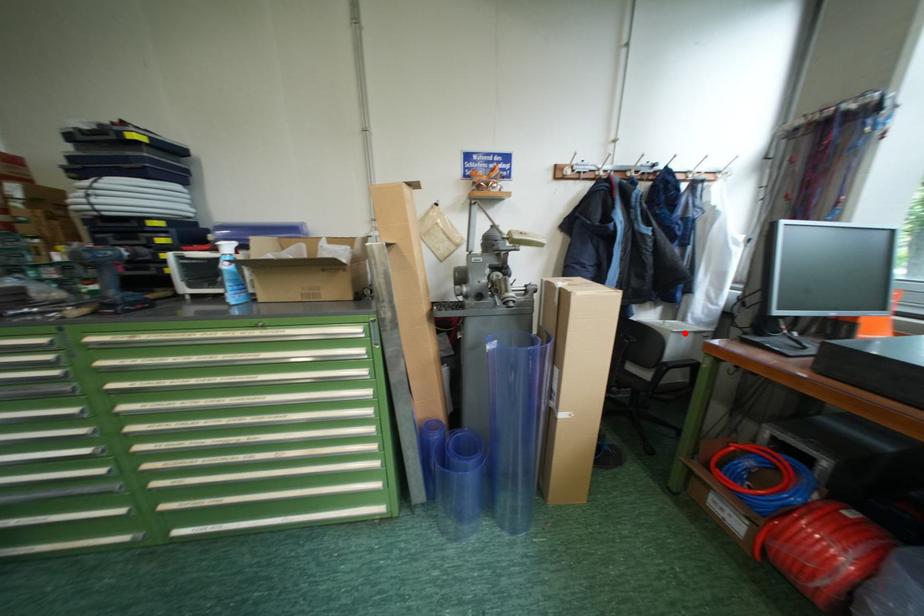
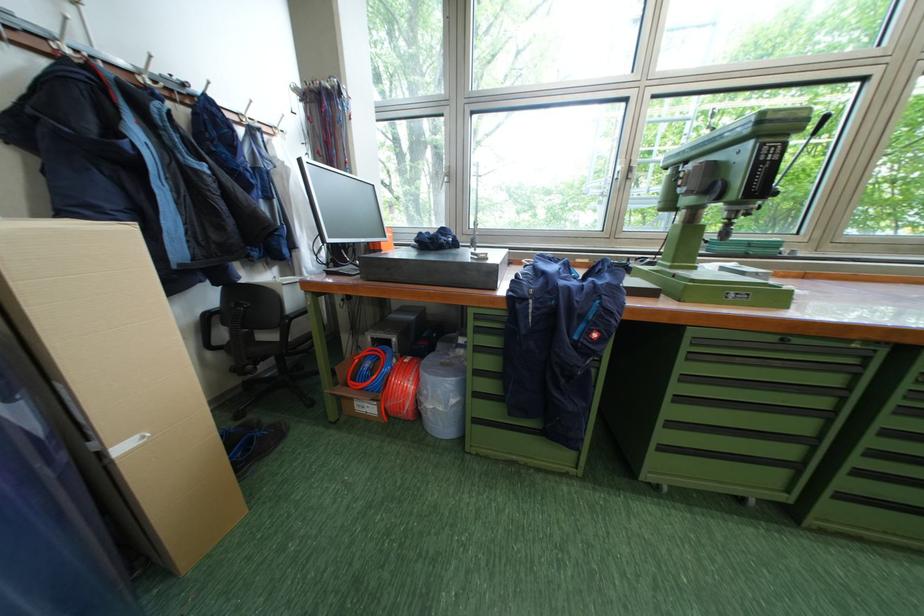
In the second image, find the point that corresponds to the highlighted location in the first image.

(295, 285)